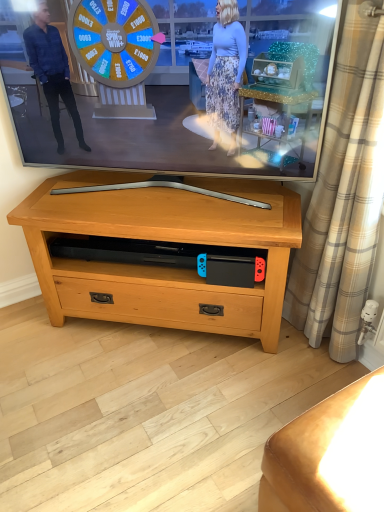
At what (x,y) coordinates should I click in order to perform the action: click on vacant space that's between pine wood tv stand at center and beige plaid curtain at right. Please return your answer as a coordinate pair (x, y). Image resolution: width=384 pixels, height=512 pixels. Looking at the image, I should click on (249, 359).